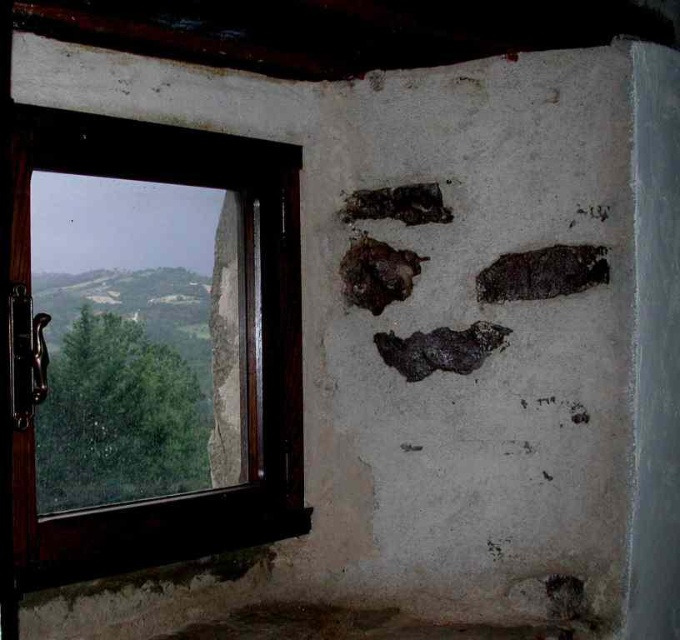
You are an inspector assessing the room for potential hazards. You notice the dark textured rock at upper right and the charcoal textured footprint at upper center on the wall. Which object is positioned farther to the east?

The dark textured rock at upper right is to the right of the charcoal textured footprint at upper center, so it is positioned farther to the east.

You are an interior designer assessing the rustic room. You notice the dark textured rock at center and the charcoal textured footprint at upper center. Which object has a greater width?

The dark textured rock at center has a greater width than the charcoal textured footprint at upper center.